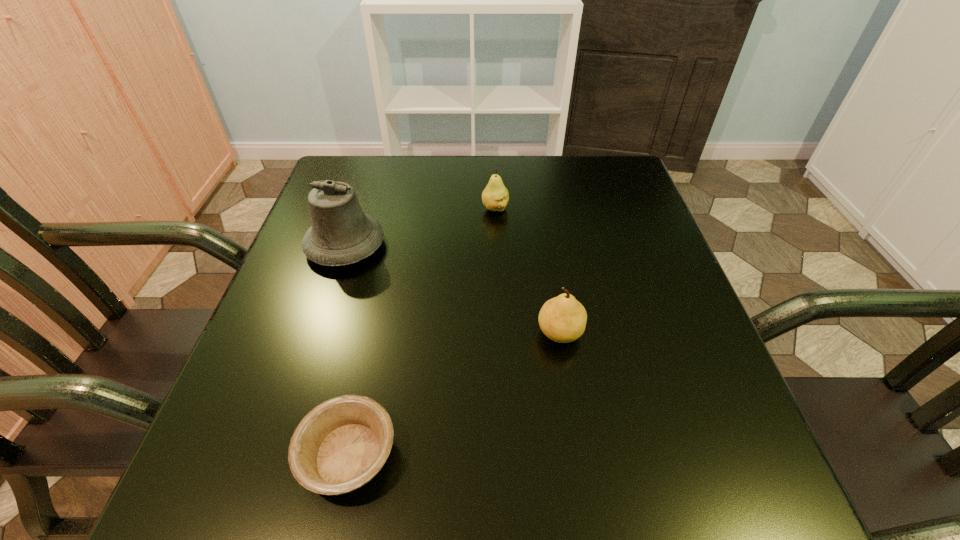
In the image, there is a desktop. Where is `vacant space at the right edge`? The height and width of the screenshot is (540, 960). vacant space at the right edge is located at coordinates (612, 231).

You are a GUI agent. You are given a task and a screenshot of the screen. Output one action in this format:
    pyautogui.click(x=<x>, y=<y>)
    Task: Click on the vacant space at the far left corner of the desktop
    This screenshot has height=540, width=960.
    Given the screenshot: What is the action you would take?
    pyautogui.click(x=367, y=178)

This screenshot has height=540, width=960. Find the location of `vacant space at the near right corner`. vacant space at the near right corner is located at coordinates (711, 493).

Find the location of `vacant area between the third object from left to right and the third farthest object`. vacant area between the third object from left to right and the third farthest object is located at coordinates (527, 271).

Locate an element on the screen. The width and height of the screenshot is (960, 540). free space between the third object from left to right and the bowl is located at coordinates (421, 332).

Where is `empty location between the third farthest object and the third nearest object`? The image size is (960, 540). empty location between the third farthest object and the third nearest object is located at coordinates (452, 289).

Find the location of a particular element. The width and height of the screenshot is (960, 540). vacant area between the farthest object and the nearest object is located at coordinates (421, 332).

Where is `free space that is in between the third object from left to right and the bell`? free space that is in between the third object from left to right and the bell is located at coordinates (420, 227).

Locate an element on the screen. free spot between the bowl and the right pear is located at coordinates (454, 394).

I want to click on blank region between the farthest object and the shortest object, so click(x=421, y=332).